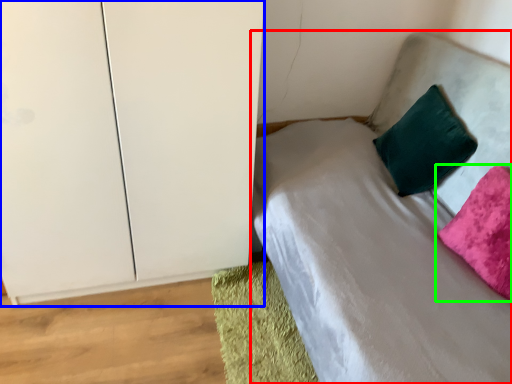
Question: Considering the real-world distances, which object is farthest from bed (highlighted by a red box)? dresser (highlighted by a blue box) or pillow (highlighted by a green box)?

Choices:
 (A) dresser
 (B) pillow

Answer: (A)